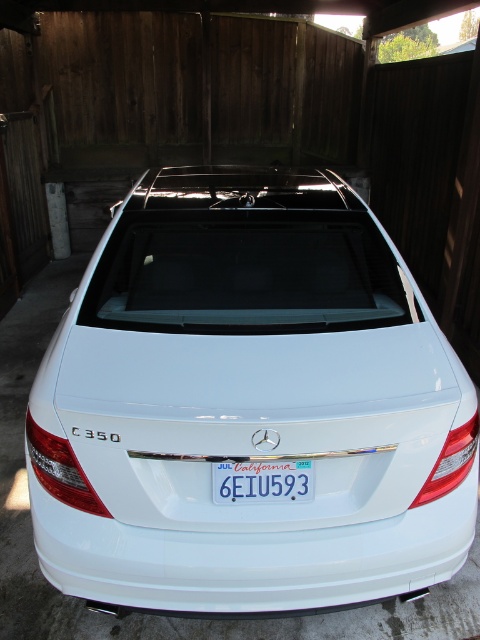
Question: Can you confirm if white glossy sedan at center is positioned below blue metallic license plate at center?

Choices:
 (A) yes
 (B) no

Answer: (B)

Question: Among these objects, which one is nearest to the camera?

Choices:
 (A) white glossy sedan at center
 (B) blue metallic license plate at center

Answer: (A)

Question: Which of the following is the closest to the observer?

Choices:
 (A) (379, 348)
 (B) (282, 493)

Answer: (B)

Question: Can you confirm if white glossy sedan at center is smaller than blue metallic license plate at center?

Choices:
 (A) no
 (B) yes

Answer: (A)

Question: Is white glossy sedan at center positioned in front of blue metallic license plate at center?

Choices:
 (A) no
 (B) yes

Answer: (B)

Question: Which point appears farthest from the camera in this image?

Choices:
 (A) (248, 502)
 (B) (437, 564)

Answer: (B)